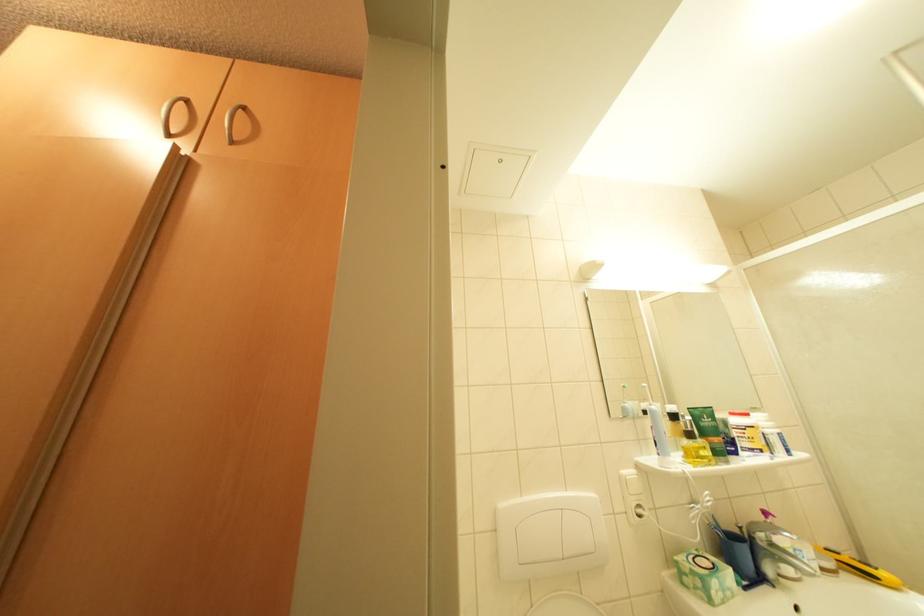
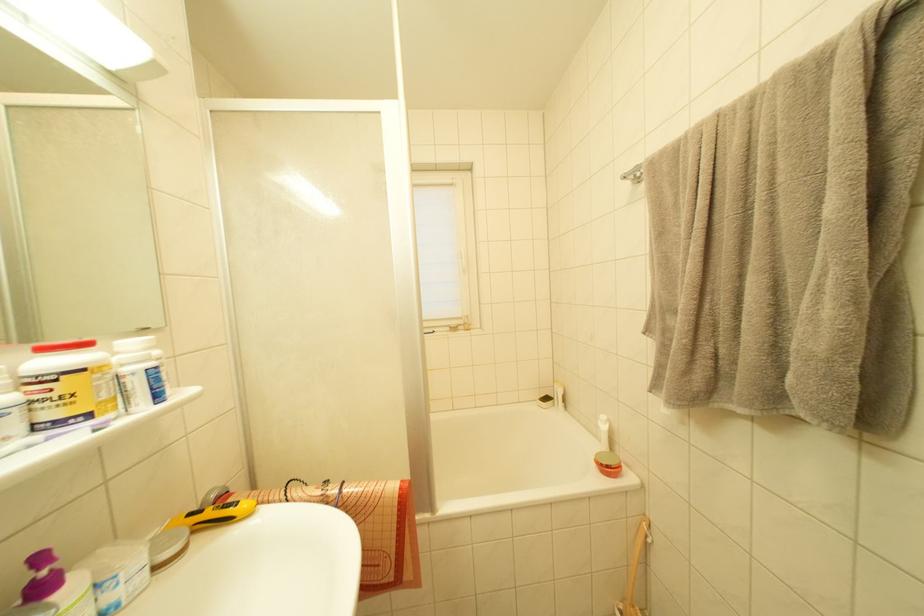
The point at (794, 456) is marked in the first image. Where is the corresponding point in the second image?

(163, 400)